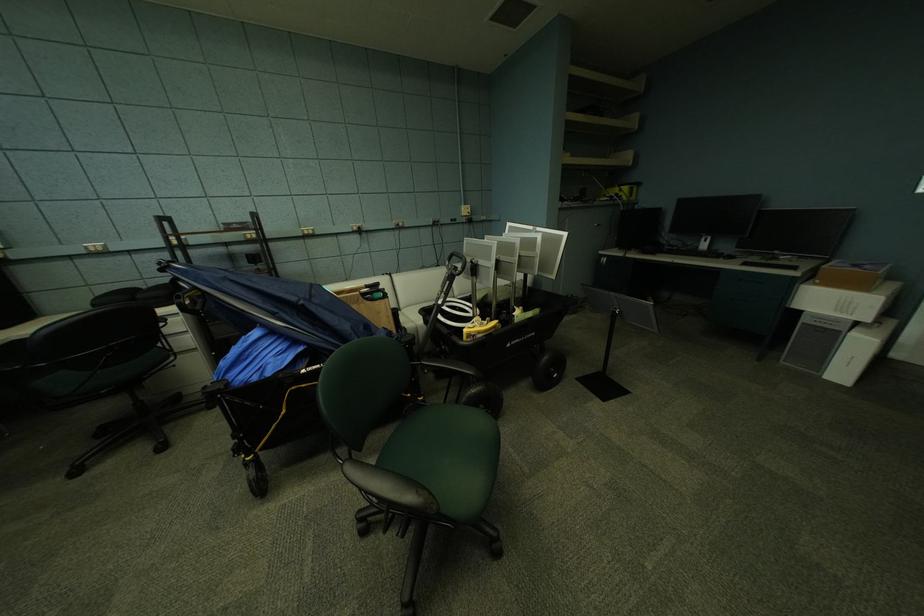
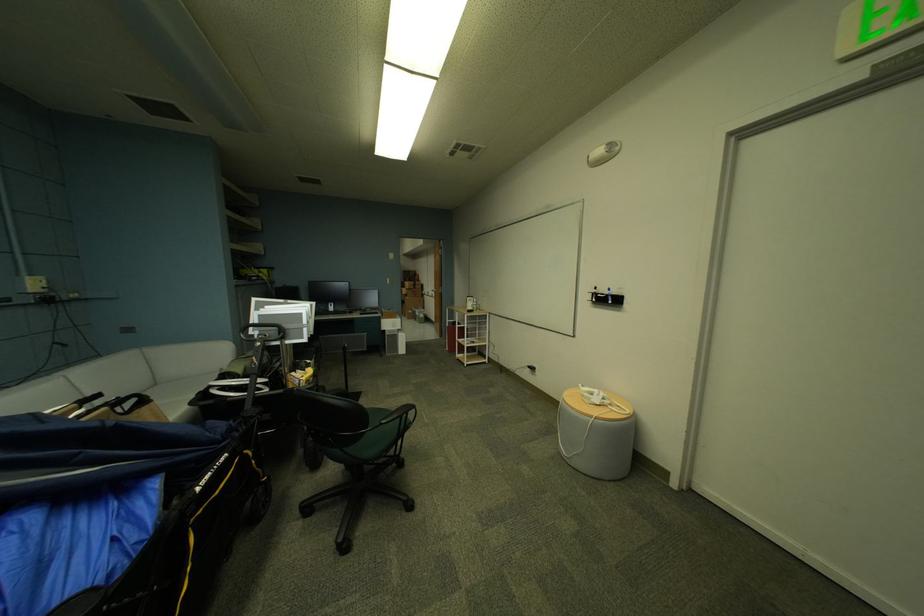
Where in the second image is the point corresponding to (x=810, y=314) from the first image?

(393, 331)